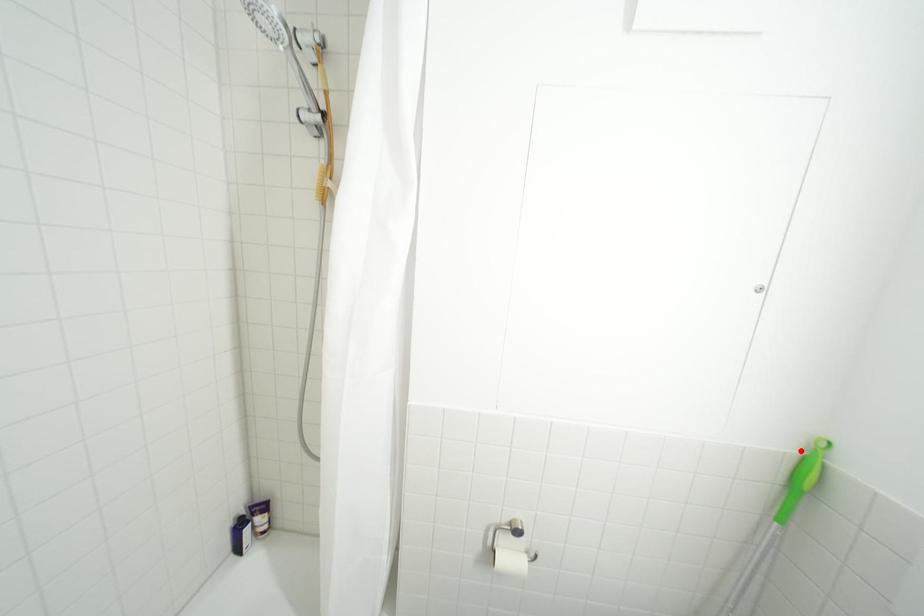
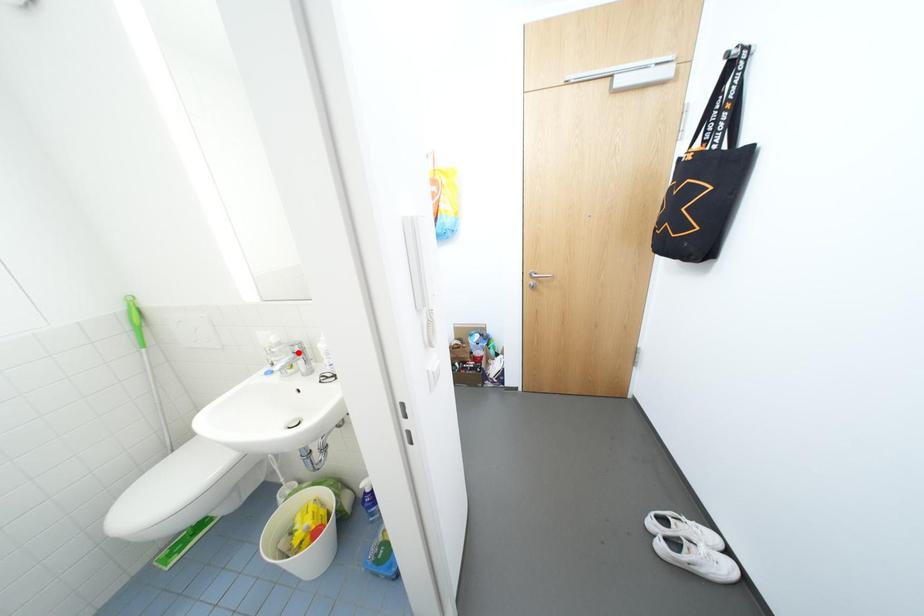
I am providing you with two images of the same scene from different viewpoints. A red point is marked on the first image and another point is marked on the second image. Do the highlighted points in image1 and image2 indicate the same real-world spot?

No